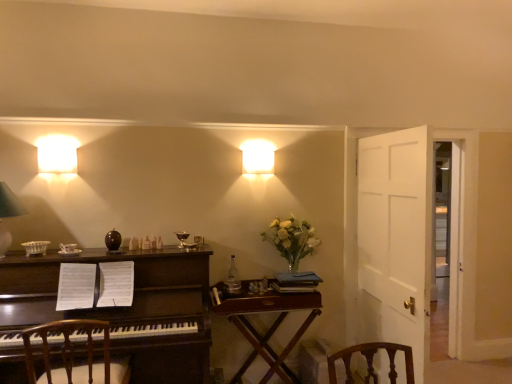
Question: Can you confirm if white wooden door at right is thinner than matte white square at upper center, the 1th lamp when ordered from back to front?

Choices:
 (A) yes
 (B) no

Answer: (B)

Question: Is white wooden door at right located outside matte white square at upper center, marked as the 3th lamp in a bottom-to-top arrangement?

Choices:
 (A) yes
 (B) no

Answer: (A)

Question: Can you confirm if white wooden door at right is positioned to the right of matte white square at upper center, positioned as the first lamp in top-to-bottom order?

Choices:
 (A) yes
 (B) no

Answer: (A)

Question: From the image's perspective, would you say white wooden door at right is positioned over matte white square at upper center, the 1th lamp when ordered from back to front?

Choices:
 (A) yes
 (B) no

Answer: (B)

Question: Does white wooden door at right have a smaller size compared to matte white square at upper center, which appears as the 1th lamp when viewed from the right?

Choices:
 (A) no
 (B) yes

Answer: (A)

Question: Considering the positions of translucent glass vase at upper right and wooden chair at left in the image, is translucent glass vase at upper right taller or shorter than wooden chair at left?

Choices:
 (A) short
 (B) tall

Answer: (A)

Question: Based on their sizes in the image, would you say translucent glass vase at upper right is bigger or smaller than wooden chair at left?

Choices:
 (A) big
 (B) small

Answer: (B)

Question: Relative to wooden chair at left, is translucent glass vase at upper right in front or behind?

Choices:
 (A) front
 (B) behind

Answer: (B)

Question: Considering the positions of translucent glass vase at upper right and wooden chair at left in the image, is translucent glass vase at upper right wider or thinner than wooden chair at left?

Choices:
 (A) thin
 (B) wide

Answer: (A)

Question: Considering the positions of dark wood desk at left and white wooden door at right in the image, is dark wood desk at left bigger or smaller than white wooden door at right?

Choices:
 (A) big
 (B) small

Answer: (A)

Question: Is dark wood desk at left situated inside white wooden door at right or outside?

Choices:
 (A) inside
 (B) outside

Answer: (B)

Question: Would you say dark wood desk at left is to the left or to the right of white wooden door at right in the picture?

Choices:
 (A) left
 (B) right

Answer: (A)

Question: Considering their positions, is dark wood desk at left located in front of or behind white wooden door at right?

Choices:
 (A) front
 (B) behind

Answer: (A)

Question: Based on their positions, is white wooden door at right located to the left or right of translucent glass vase at upper right?

Choices:
 (A) right
 (B) left

Answer: (A)

Question: From the image's perspective, is white wooden door at right positioned above or below translucent glass vase at upper right?

Choices:
 (A) above
 (B) below

Answer: (B)